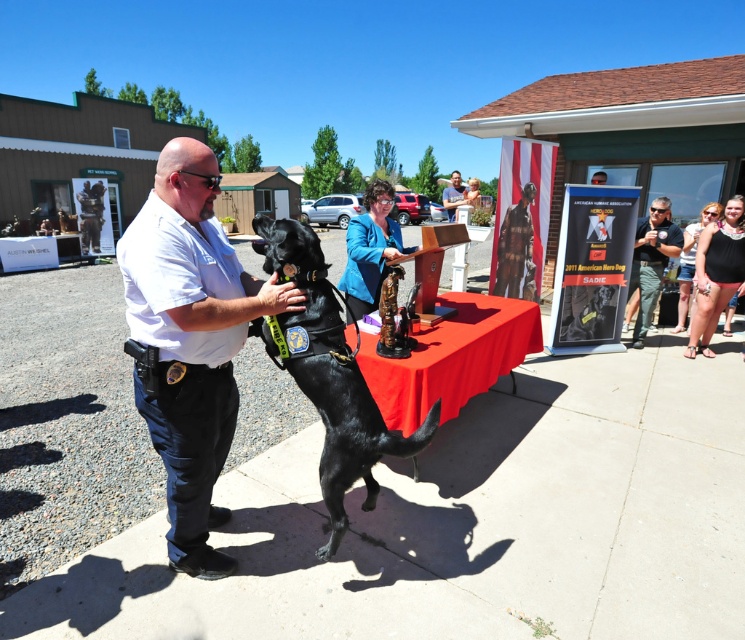
You are a photographer at the event and need to capture a photo of the white uniform at center and the black matte dog at center. Based on their positions, which object should you focus on first if you start from the left side of the scene?

The white uniform at center should be focused on first since it is positioned to the left of the black matte dog at center.

You are organizing a community event and need to place a large banner on either the red cloth table at center or the matte black uniform at center. Which object is more suitable based on their sizes?

The matte black uniform at center is larger than the red cloth table at center, so it would be more suitable for placing a large banner.

You are organizing a community event and need to arrange two items on a stage. The items are the white uniform at center and the black matte dog at center. If the stage has limited space, which item requires more width to accommodate?

The black matte dog at center requires more width because the white uniform at center is narrower than it.